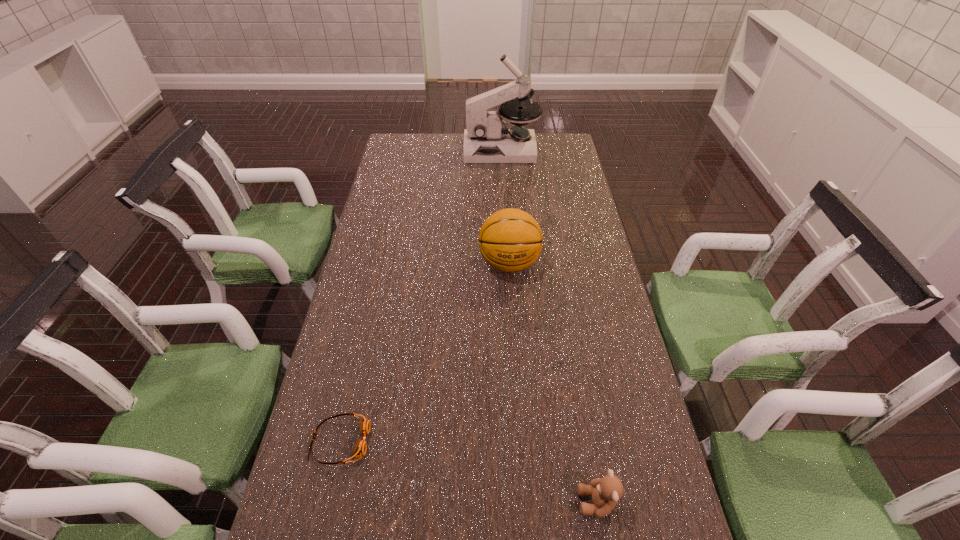
Find the location of a particular element. the farthest object is located at coordinates (487, 139).

At what (x,y) coordinates should I click in order to perform the action: click on microscope. Please return your answer as a coordinate pair (x, y). The image size is (960, 540). Looking at the image, I should click on (487, 139).

Find the location of a particular element. the third nearest object is located at coordinates (510, 240).

Identify the location of basketball. Image resolution: width=960 pixels, height=540 pixels. (510, 240).

Image resolution: width=960 pixels, height=540 pixels. I want to click on the third tallest object, so 606,491.

Image resolution: width=960 pixels, height=540 pixels. In order to click on the nearest object in this screenshot , I will do `click(606, 491)`.

Identify the location of the leftmost object. (359, 451).

The height and width of the screenshot is (540, 960). I want to click on the third farthest object, so pyautogui.click(x=359, y=451).

Locate an element on the screen. Image resolution: width=960 pixels, height=540 pixels. blank area located at the eyepiece of the microscope is located at coordinates (389, 150).

I want to click on free space located 0.210m at the eyepiece of the microscope, so click(x=417, y=150).